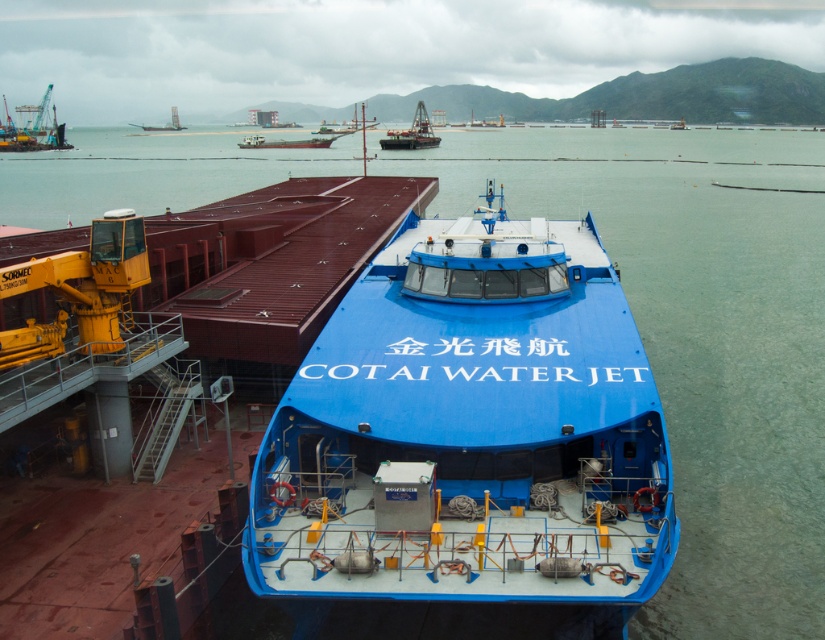
Which is above, blue matte boat at center or blue metallic boat at center?

blue metallic boat at center

Does blue matte boat at center have a smaller size compared to blue metallic boat at center?

Yes, blue matte boat at center is smaller than blue metallic boat at center.

Identify the location of blue matte boat at center. The image size is (825, 640). (469, 429).

Does blue metallic boat at center appear under brown matte boat at center?

Incorrect, blue metallic boat at center is not positioned below brown matte boat at center.

Where is `blue metallic boat at center`? The width and height of the screenshot is (825, 640). blue metallic boat at center is located at coordinates (412, 132).

The image size is (825, 640). In order to click on blue metallic boat at center in this screenshot , I will do `click(412, 132)`.

Does point (243, 145) lie behind point (158, 129)?

No.

Is brown matte boat at center taller than metallic gray boat at upper center?

Correct, brown matte boat at center is much taller as metallic gray boat at upper center.

You are a GUI agent. You are given a task and a screenshot of the screen. Output one action in this format:
    pyautogui.click(x=<x>, y=<y>)
    Task: Click on the brown matte boat at center
    This screenshot has height=640, width=825.
    Given the screenshot: What is the action you would take?
    pyautogui.click(x=284, y=141)

I want to click on brown matte boat at center, so click(284, 141).